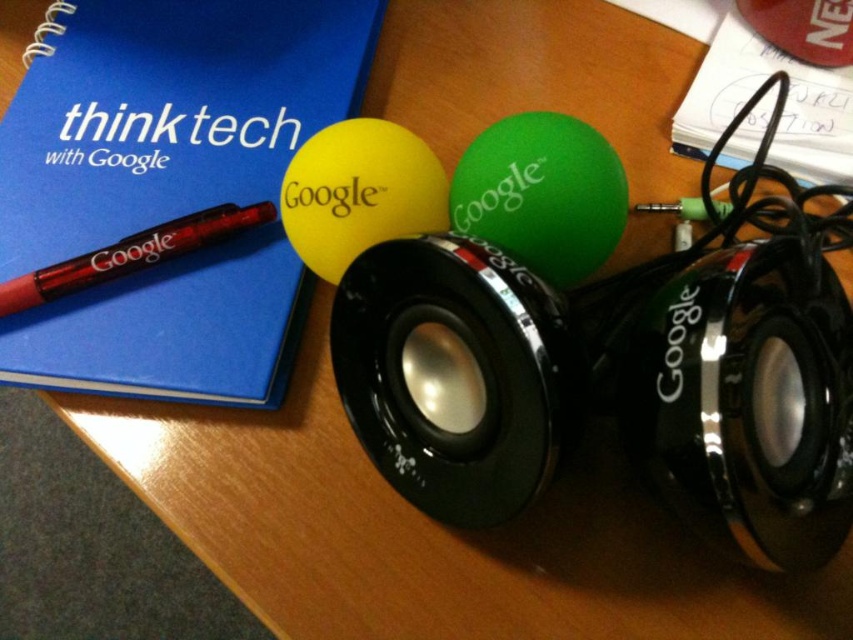
Question: Which point is closer to the camera?

Choices:
 (A) (569, 275)
 (B) (173, 317)
 (C) (627, 336)
 (D) (399, 193)

Answer: (D)

Question: Can you confirm if blue matte notebook at upper left is smaller than translucent red pen at left?

Choices:
 (A) no
 (B) yes

Answer: (A)

Question: Is blue matte notebook at upper left positioned before yellow rubber balloon at center?

Choices:
 (A) no
 (B) yes

Answer: (A)

Question: Does blue matte notebook at upper left have a lesser width compared to yellow rubber balloon at center?

Choices:
 (A) yes
 (B) no

Answer: (B)

Question: Which object is farther from the camera taking this photo?

Choices:
 (A) translucent red pen at left
 (B) blue matte notebook at upper left

Answer: (A)

Question: Estimate the real-world distances between objects in this image. Which object is closer to the yellow rubber balloon at center?

Choices:
 (A) black metallic speaker at center
 (B) green rubber balloon at center
 (C) translucent red pen at left

Answer: (B)